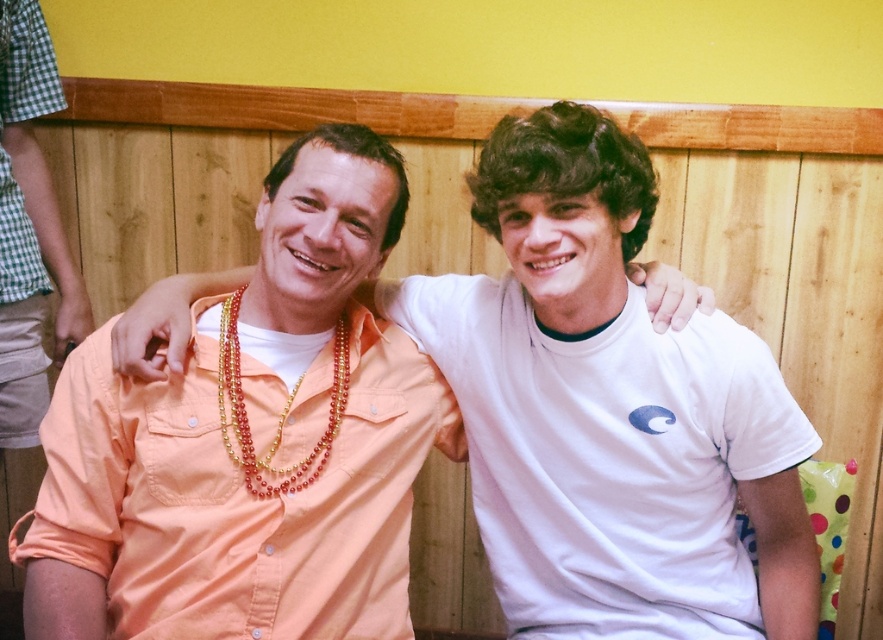
Who is taller, orange cotton shirt at left or checkered fabric shorts at left?

checkered fabric shorts at left is taller.

Can you confirm if orange cotton shirt at left is positioned to the left of checkered fabric shorts at left?

No, orange cotton shirt at left is not to the left of checkered fabric shorts at left.

Locate an element on the screen. Image resolution: width=883 pixels, height=640 pixels. orange cotton shirt at left is located at coordinates (238, 499).

Where is `orange cotton shirt at left`? This screenshot has width=883, height=640. orange cotton shirt at left is located at coordinates (238, 499).

Can you confirm if orange cotton shirt at center is positioned to the right of checkered fabric shorts at left?

Yes, orange cotton shirt at center is to the right of checkered fabric shorts at left.

Is orange cotton shirt at center above checkered fabric shorts at left?

Actually, orange cotton shirt at center is below checkered fabric shorts at left.

Which is behind, point (563, 157) or point (31, 81)?

The point (31, 81) is more distant.

At what (x,y) coordinates should I click in order to perform the action: click on orange cotton shirt at center. Please return your answer as a coordinate pair (x, y). The image size is (883, 640). Looking at the image, I should click on (609, 408).

Consider the image. Can you confirm if orange cotton shirt at center is wider than multicolored beaded necklace at center?

Yes.

Does orange cotton shirt at center have a lesser width compared to multicolored beaded necklace at center?

In fact, orange cotton shirt at center might be wider than multicolored beaded necklace at center.

Is point (586, 428) in front of point (224, 300)?

Yes, it is.

Where is `orange cotton shirt at center`? The image size is (883, 640). orange cotton shirt at center is located at coordinates (609, 408).